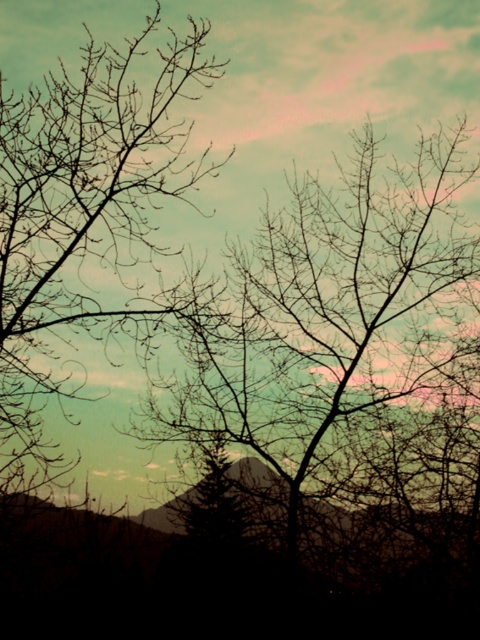
You are an artist sketching this scene and want to add details to the silhouette bark tree at upper left and the silhouette bare branches at left. Which object should you draw first to maintain the correct spatial relationship?

You should draw the silhouette bark tree at upper left first because it is closer to the viewer than the silhouette bare branches at left, so it should be placed in front.

You are an artist sketching the landscape and want to ensure accuracy. Which object has a greater width between the silhouette bark tree at upper left and the silhouette bare branches at left?

The silhouette bark tree at upper left has a greater width than the silhouette bare branches at left.